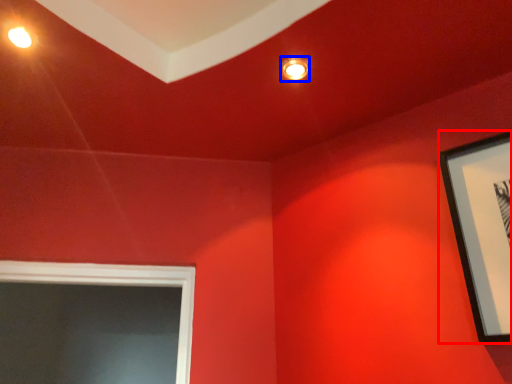
Question: Among these objects, which one is nearest to the camera, picture frame (highlighted by a red box) or lighting (highlighted by a blue box)?

Choices:
 (A) picture frame
 (B) lighting

Answer: (A)